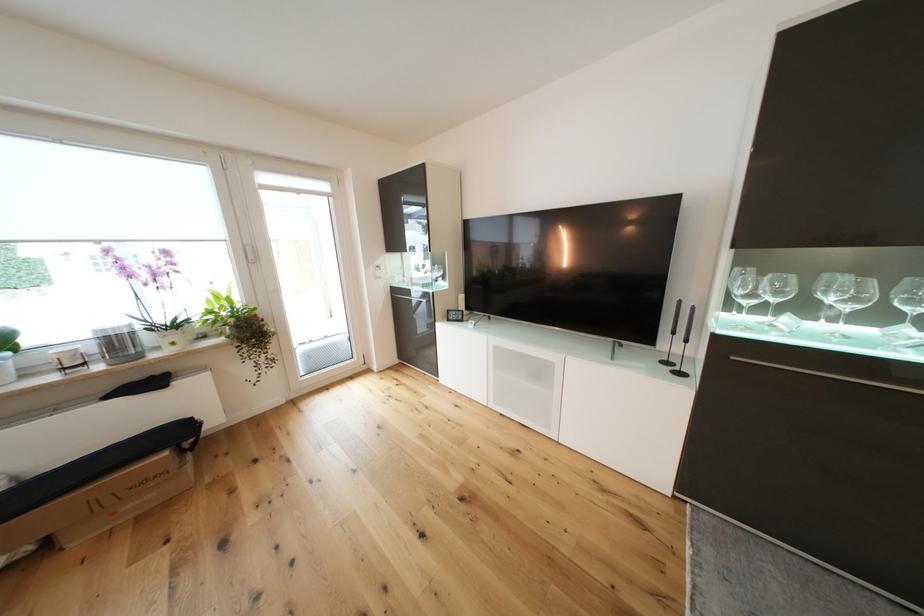
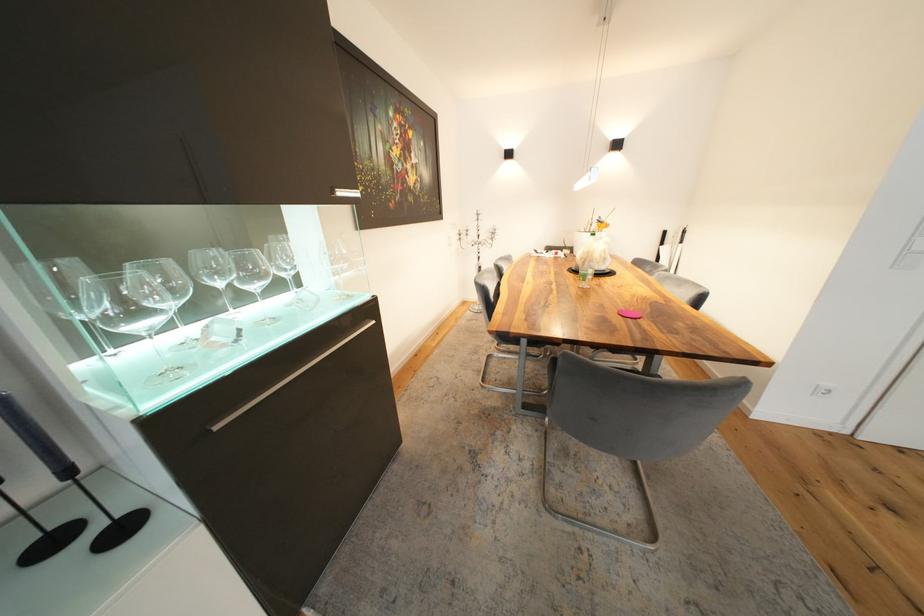
The images are taken continuously from a first-person perspective. In which direction is your viewpoint rotating?

The camera's rotation is toward right-down.